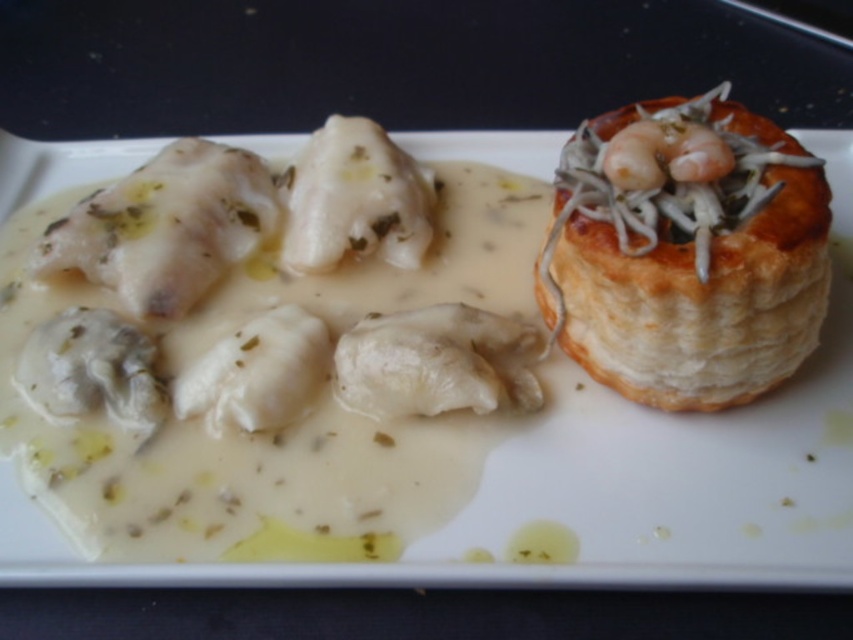
Locate an element on the screen. The width and height of the screenshot is (853, 640). white creamy sauce at upper left is located at coordinates (585, 504).

Does point (693, 556) lie behind point (737, 170)?

That is False.

Image resolution: width=853 pixels, height=640 pixels. What are the coordinates of `white creamy sauce at upper left` in the screenshot? It's located at (585, 504).